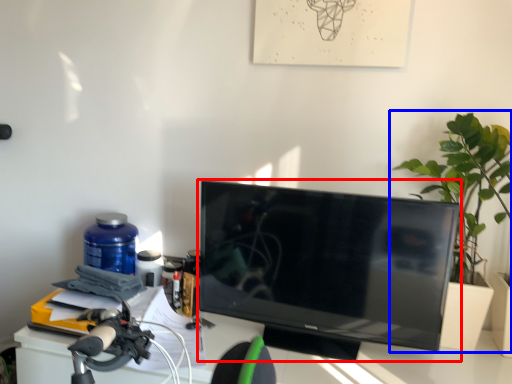
Question: Which point is further to the camera, television (highlighted by a red box) or houseplant (highlighted by a blue box)?

Choices:
 (A) television
 (B) houseplant

Answer: (B)